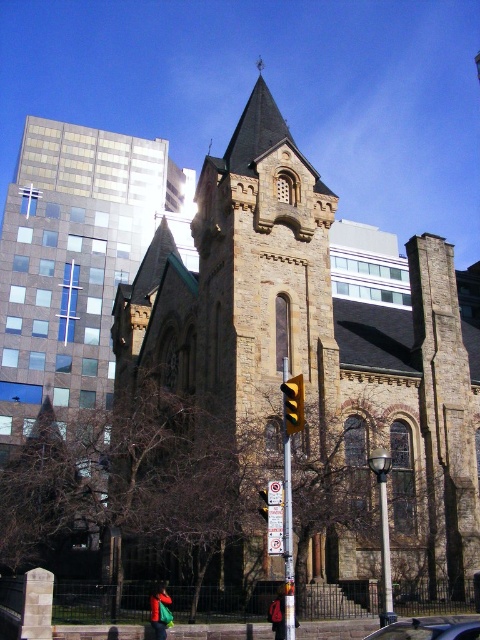
Who is lower down, brown stone church at center or yellow matte traffic light at center?

Positioned lower is yellow matte traffic light at center.

Does brown stone church at center come behind yellow matte traffic light at center?

That is True.

From the picture: Who is more distant from viewer, (333, 548) or (300, 385)?

The point (333, 548) is more distant.

The width and height of the screenshot is (480, 640). I want to click on brown stone church at center, so click(x=319, y=346).

Is point (402, 621) farther from viewer compared to point (301, 387)?

Yes, it is behind point (301, 387).

Can you confirm if metallic silver car at center is shorter than yellow matte traffic light at center?

Incorrect, metallic silver car at center's height does not fall short of yellow matte traffic light at center's.

This screenshot has height=640, width=480. What do you see at coordinates (431, 628) in the screenshot? I see `metallic silver car at center` at bounding box center [431, 628].

Locate an element on the screen. Image resolution: width=480 pixels, height=640 pixels. metallic silver car at center is located at coordinates (431, 628).

Consider the image. Is brown stone church at center below metallic silver car at center?

Actually, brown stone church at center is above metallic silver car at center.

Is brown stone church at center above metallic silver car at center?

Yes, brown stone church at center is above metallic silver car at center.

You are a GUI agent. You are given a task and a screenshot of the screen. Output one action in this format:
    pyautogui.click(x=<x>, y=<y>)
    Task: Click on the brown stone church at center
    This screenshot has height=640, width=480.
    Given the screenshot: What is the action you would take?
    pyautogui.click(x=319, y=346)

Locate an element on the screen. This screenshot has height=640, width=480. brown stone church at center is located at coordinates (319, 346).